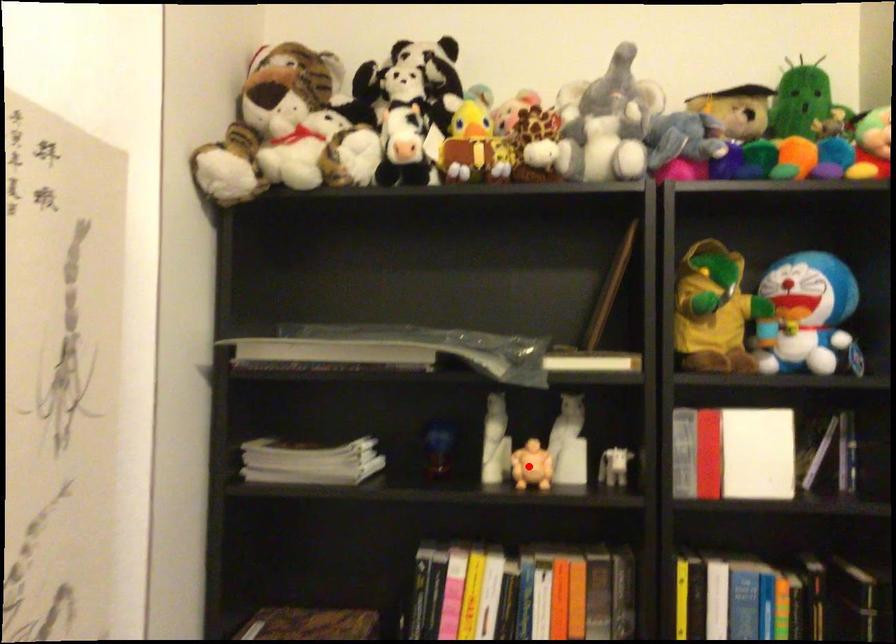
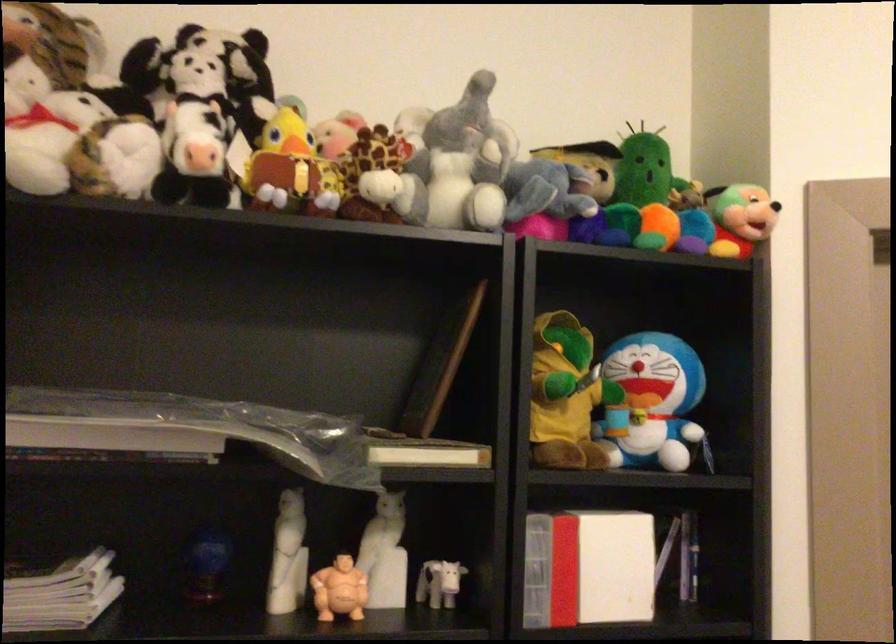
Question: I am providing you with two images of the same scene from different viewpoints. Image1 has a red point marked. In image2, the corresponding 3D location appears at what relative position? Reply with the corresponding letter.

Choices:
 (A) Closer
 (B) Farther

Answer: (A)